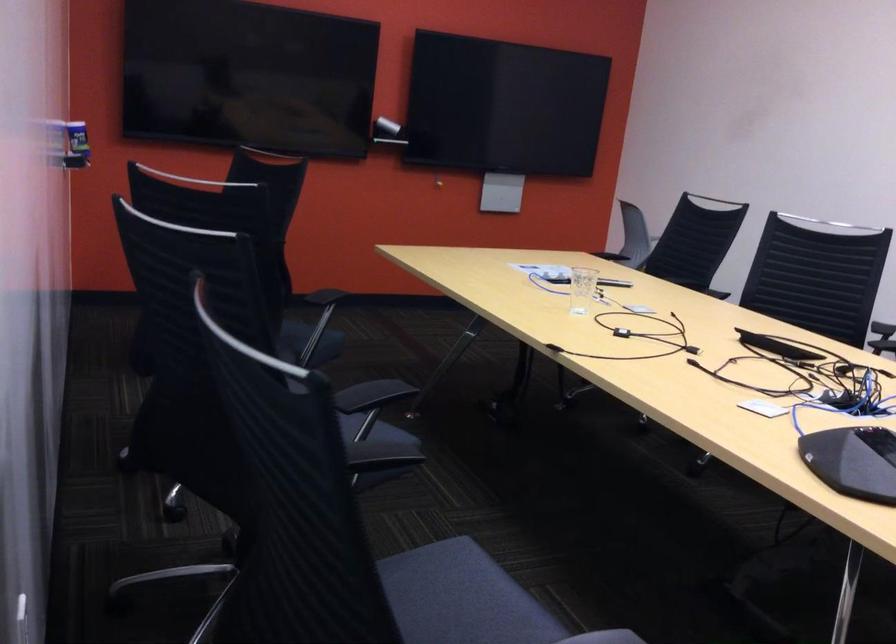
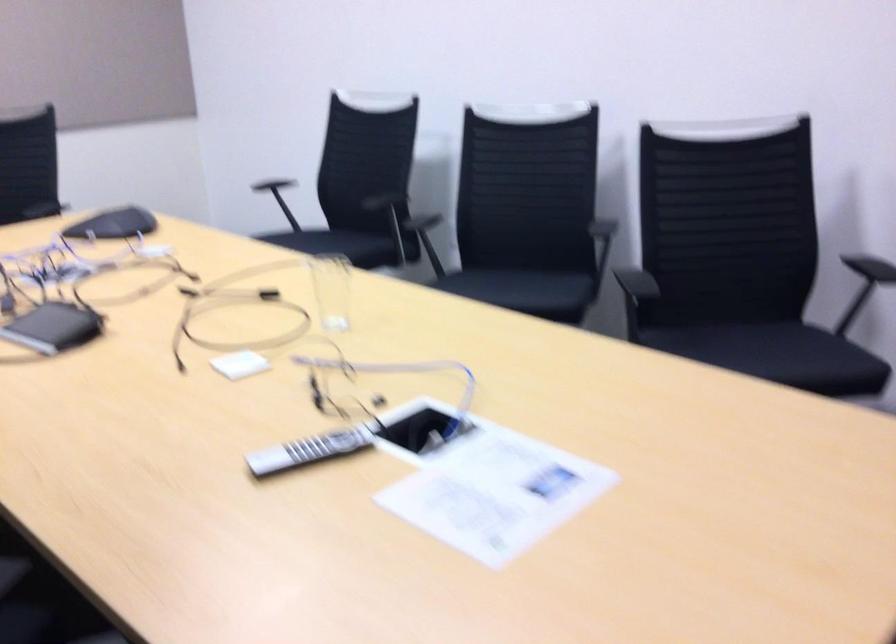
Question: I am providing you with two images of the same scene from different viewpoints. After the viewpoint changes to image2, which objects are now occluded?

Choices:
 (A) chair sitting surface
 (B) sheet of paper
 (C) black conference phone
 (D) black electronic device

Answer: (C)